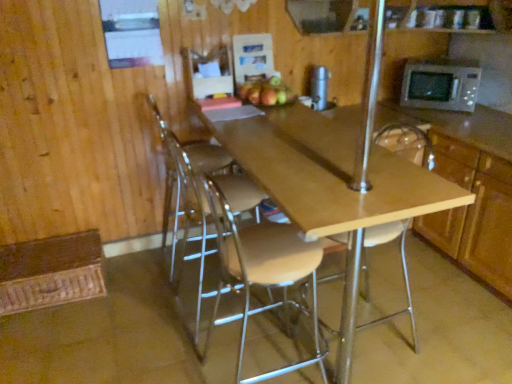
Locate an element on the screen. free space that is in between clear plastic chair at center, which is counted as the first chair, starting from the left, and brown woven mat at lower left is located at coordinates (139, 272).